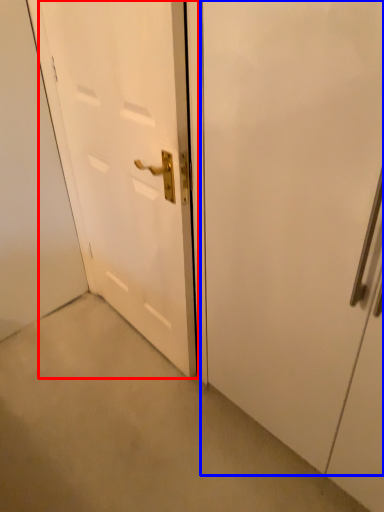
Question: Among these objects, which one is nearest to the camera, door (highlighted by a red box) or door (highlighted by a blue box)?

Choices:
 (A) door
 (B) door

Answer: (B)